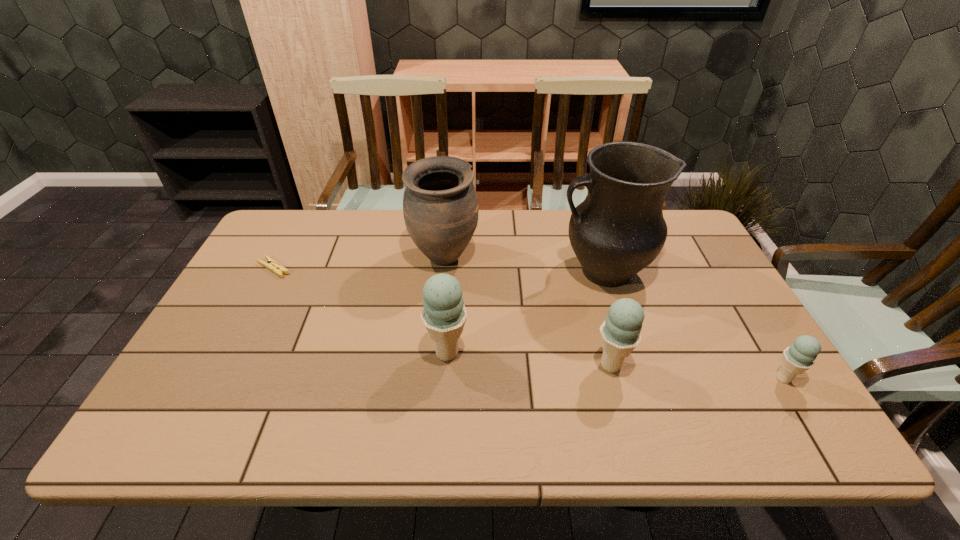
The image size is (960, 540). I want to click on object at the right edge, so click(799, 357).

This screenshot has width=960, height=540. I want to click on object at the near right corner, so coord(799,357).

Locate an element on the screen. This screenshot has width=960, height=540. vacant space at the far edge of the desktop is located at coordinates (325, 215).

Locate an element on the screen. The image size is (960, 540). vacant space at the near edge of the desktop is located at coordinates (428, 394).

In the image, there is a desktop. At what (x,y) coordinates should I click in order to perform the action: click on free space at the right edge. Please return your answer as a coordinate pair (x, y). The height and width of the screenshot is (540, 960). Looking at the image, I should click on (741, 367).

This screenshot has height=540, width=960. I want to click on vacant space at the far right corner of the desktop, so click(x=678, y=241).

Find the location of `free spot between the shortest object and the rightmost object`. free spot between the shortest object and the rightmost object is located at coordinates (529, 323).

I want to click on free point between the tallest object and the urn, so 523,265.

In order to click on vacant area that lies between the second shortest object and the pitcher in this screenshot , I will do `click(693, 325)`.

Where is `free spot between the urn and the second shortest ice cream`? The height and width of the screenshot is (540, 960). free spot between the urn and the second shortest ice cream is located at coordinates (528, 312).